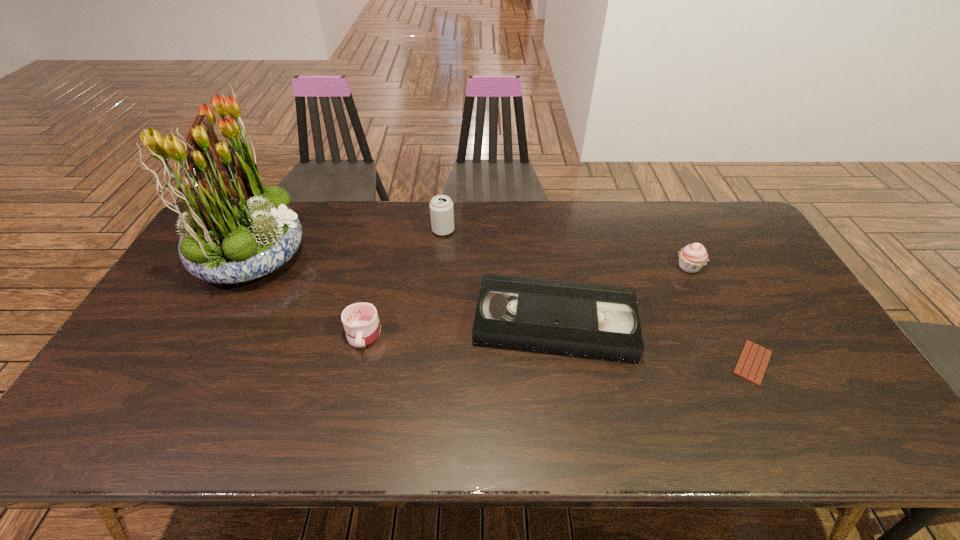
This screenshot has width=960, height=540. In the image, there is a desktop. Find the location of `free space at the far edge`. free space at the far edge is located at coordinates (606, 207).

In the image, there is a desktop. Where is `blank space at the near edge`? The width and height of the screenshot is (960, 540). blank space at the near edge is located at coordinates (207, 414).

In the image, there is a desktop. Where is `vacant space at the left edge`? Image resolution: width=960 pixels, height=540 pixels. vacant space at the left edge is located at coordinates (178, 306).

In the image, there is a desktop. Identify the location of vacant space at the right edge. This screenshot has width=960, height=540. (752, 299).

Locate an element on the screen. free space at the near left corner of the desktop is located at coordinates (133, 437).

This screenshot has height=540, width=960. I want to click on blank space at the far right corner of the desktop, so click(x=740, y=217).

At what (x,y) coordinates should I click in order to perform the action: click on free space between the shortest object and the second shortest object. Please return your answer as a coordinate pair (x, y). This screenshot has height=540, width=960. Looking at the image, I should click on (654, 343).

At what (x,y) coordinates should I click in order to perform the action: click on free space between the fourth object from right to left and the mug. Please return your answer as a coordinate pair (x, y). This screenshot has width=960, height=540. Looking at the image, I should click on (403, 282).

Find the location of a particular element. vacant area between the candy bar and the fourth shortest object is located at coordinates (721, 315).

I want to click on blank region between the fourth object from right to left and the flower arrangement, so click(x=348, y=242).